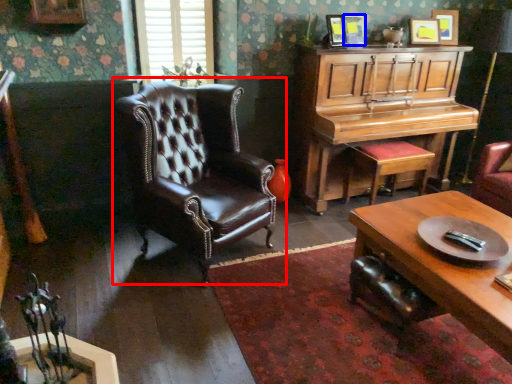
Question: Which point is closer to the camera, chair (highlighted by a red box) or picture frame (highlighted by a blue box)?

Choices:
 (A) chair
 (B) picture frame

Answer: (A)